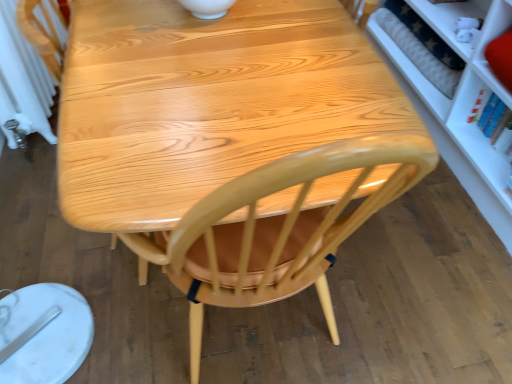
Identify the location of white radiator at left. (22, 81).

What do you see at coordinates (22, 81) in the screenshot? This screenshot has width=512, height=384. I see `white radiator at left` at bounding box center [22, 81].

This screenshot has height=384, width=512. Describe the element at coordinates (277, 229) in the screenshot. I see `glossy wood chair at center` at that location.

Find the location of a particular element. glossy wood chair at center is located at coordinates (277, 229).

Identify the location of white radiator at left. (22, 81).

Does glossy wood chair at center appear on the right side of white radiator at left?

Yes.

Does glossy wood chair at center come in front of white radiator at left?

Yes, it is.

Which is in front, point (335, 327) or point (54, 139)?

The point (335, 327) is more forward.

From the image's perspective, does glossy wood chair at center appear higher than white radiator at left?

No, from the image's perspective, glossy wood chair at center is not above white radiator at left.

Consider the image. From a real-world perspective, which object rests below the other?

glossy wood chair at center is physically lower.

Between glossy wood chair at center and white radiator at left, which one has larger width?

glossy wood chair at center.

Considering the sizes of objects glossy wood chair at center and white radiator at left in the image provided, who is shorter, glossy wood chair at center or white radiator at left?

glossy wood chair at center is shorter.

Is glossy wood chair at center bigger than white radiator at left?

Yes.

Is glossy wood chair at center situated inside white radiator at left or outside?

glossy wood chair at center is not inside white radiator at left, it's outside.

Is glossy wood chair at center placed right next to white radiator at left?

No.

Is glossy wood chair at center looking in the opposite direction of white radiator at left?

No, glossy wood chair at center is not facing the opposite direction of white radiator at left.

This screenshot has height=384, width=512. I want to click on chair located underneath the white radiator at left (from a real-world perspective), so click(x=277, y=229).

Consider the image. Between white radiator at left and glossy wood chair at center, which one appears on the right side from the viewer's perspective?

Positioned to the right is glossy wood chair at center.

Based on the photo, considering the positions of objects white radiator at left and glossy wood chair at center in the image provided, who is in front, white radiator at left or glossy wood chair at center?

Positioned in front is glossy wood chair at center.

Considering the positions of point (20, 36) and point (368, 202), is point (20, 36) closer or farther from the camera than point (368, 202)?

Point (20, 36).

From the image's perspective, would you say white radiator at left is shown under glossy wood chair at center?

No, from the image's perspective, white radiator at left is not beneath glossy wood chair at center.

From a real-world perspective, who is located higher, white radiator at left or glossy wood chair at center?

From a 3D spatial view, white radiator at left is above.

Considering the sizes of objects white radiator at left and glossy wood chair at center in the image provided, who is wider, white radiator at left or glossy wood chair at center?

glossy wood chair at center.

Considering the relative sizes of white radiator at left and glossy wood chair at center in the image provided, is white radiator at left shorter than glossy wood chair at center?

No.

Consider the image. In terms of size, does white radiator at left appear bigger or smaller than glossy wood chair at center?

In the image, white radiator at left appears to be smaller than glossy wood chair at center.

Is white radiator at left inside or outside of glossy wood chair at center?

white radiator at left exists outside the volume of glossy wood chair at center.

Is white radiator at left positioned far away from glossy wood chair at center?

Absolutely, white radiator at left is distant from glossy wood chair at center.

Based on the photo, is white radiator at left aimed at glossy wood chair at center?

No, white radiator at left is not oriented towards glossy wood chair at center.

How different are the orientations of white radiator at left and glossy wood chair at center in degrees?

The angle between the facing direction of white radiator at left and the facing direction of glossy wood chair at center is 89.3 degrees.

What are the coordinates of `radiator lying on the left of glossy wood chair at center` in the screenshot? It's located at (22, 81).

The height and width of the screenshot is (384, 512). I want to click on radiator on the left of the glossy wood chair at center, so click(x=22, y=81).

What are the coordinates of `radiator above the glossy wood chair at center (from a real-world perspective)` in the screenshot? It's located at (22, 81).